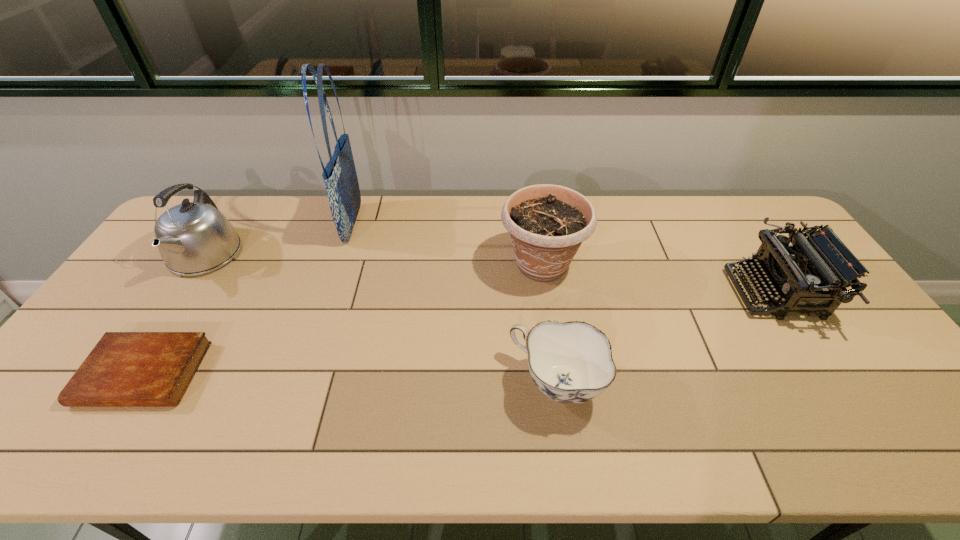
Find the location of a particular element. vacant area that lies between the kettle and the Bible is located at coordinates (175, 315).

At what (x,y) coordinates should I click in order to perform the action: click on unoccupied position between the shopping bag and the Bible. Please return your answer as a coordinate pair (x, y). The image size is (960, 540). Looking at the image, I should click on (249, 299).

Where is `unoccupied area between the rightmost object and the kettle`? The image size is (960, 540). unoccupied area between the rightmost object and the kettle is located at coordinates (490, 274).

Where is `unoccupied position between the chinaware and the rightmost object`? The width and height of the screenshot is (960, 540). unoccupied position between the chinaware and the rightmost object is located at coordinates (665, 339).

The height and width of the screenshot is (540, 960). Find the location of `vacant area between the chinaware and the rightmost object`. vacant area between the chinaware and the rightmost object is located at coordinates (665, 339).

What are the coordinates of `free spot between the flowerpot and the rightmost object` in the screenshot? It's located at (659, 279).

You are a GUI agent. You are given a task and a screenshot of the screen. Output one action in this format:
    pyautogui.click(x=<x>, y=<y>)
    Task: Click on the object that is the fourth nearest to the shopping bag
    The width and height of the screenshot is (960, 540).
    Given the screenshot: What is the action you would take?
    pyautogui.click(x=571, y=362)

Find the location of `object that is the fourth closest to the fifth tallest object`. object that is the fourth closest to the fifth tallest object is located at coordinates (125, 369).

The width and height of the screenshot is (960, 540). I want to click on free space that satisfies the following two spatial constraints: 1. on the spout of the kettle; 2. on the left side of the flowerpot, so click(199, 265).

Where is `free location that satisfies the following two spatial constraints: 1. on the front-facing side of the third object from left to right; 2. on the left side of the flowerpot`? This screenshot has height=540, width=960. free location that satisfies the following two spatial constraints: 1. on the front-facing side of the third object from left to right; 2. on the left side of the flowerpot is located at coordinates (340, 265).